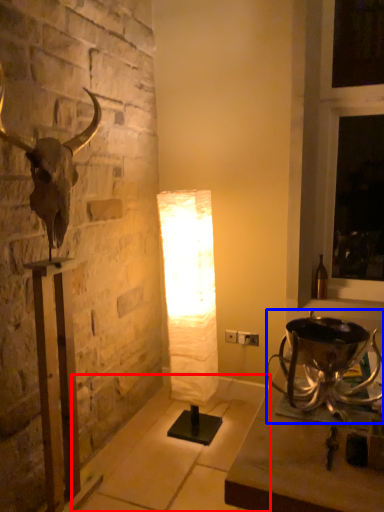
Question: Which object appears closest to the camera in this image, concrete (highlighted by a red box) or candle holder (highlighted by a blue box)?

Choices:
 (A) concrete
 (B) candle holder

Answer: (B)